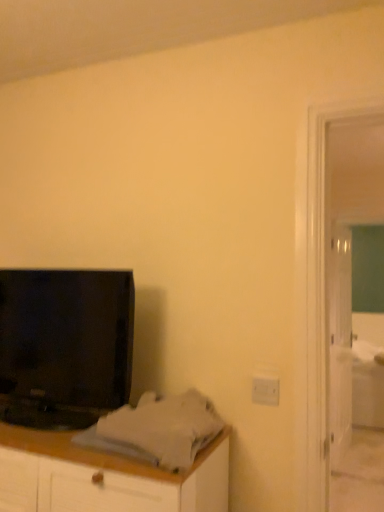
This screenshot has width=384, height=512. Describe the element at coordinates (64, 346) in the screenshot. I see `black glossy television at left` at that location.

Locate an element on the screen. The width and height of the screenshot is (384, 512). white fabric bed at right is located at coordinates (368, 372).

At what (x,y) coordinates should I click in order to perform the action: click on white glossy door at right. Please return your answer as a coordinate pair (x, y). Image resolution: width=384 pixels, height=512 pixels. Looking at the image, I should click on (340, 342).

Is point (98, 328) more distant than point (309, 280)?

Yes, it is behind point (309, 280).

Is black glossy television at left surrounding green glass screen door at right?

No.

Is the position of black glossy television at left more distant than that of green glass screen door at right?

That is False.

Is black glossy television at left turned away from white glossy door at right?

Yes, black glossy television at left is positioned with its back facing white glossy door at right.

Relative to white glossy door at right, is black glossy television at left in front or behind?

In the image, black glossy television at left appears in front of white glossy door at right.

Is black glossy television at left surrounding white glossy door at right?

No, white glossy door at right is not surrounded by black glossy television at left.

Considering the relative sizes of black glossy television at left and white glossy door at right in the image provided, is black glossy television at left shorter than white glossy door at right?

Indeed, black glossy television at left has a lesser height compared to white glossy door at right.

Does white glossy door at right have a greater width compared to black glossy television at left?

In fact, white glossy door at right might be narrower than black glossy television at left.

Who is more distant, white glossy door at right or black glossy television at left?

white glossy door at right is more distant.

From the image's perspective, is white glossy door at right located beneath black glossy television at left?

Yes.

Is white glossy door at right aimed at black glossy television at left?

No, white glossy door at right is not turned towards black glossy television at left.

How many degrees apart are the facing directions of green glass screen door at right and white glossy door at right?

83.4 degrees separate the facing orientations of green glass screen door at right and white glossy door at right.

Can you confirm if green glass screen door at right is shorter than white glossy door at right?

No.

Considering the positions of points (308, 280) and (339, 244), is point (308, 280) closer to camera compared to point (339, 244)?

Yes, it is in front of point (339, 244).

Is green glass screen door at right turned away from white glossy door at right?

Absolutely, green glass screen door at right is directed away from white glossy door at right.

Is black glossy television at left surrounded by white fabric bed at right?

No, black glossy television at left is not a part of white fabric bed at right.

Based on their positions, is white fabric bed at right located to the left or right of black glossy television at left?

white fabric bed at right is to the right of black glossy television at left.

From a real-world perspective, is white fabric bed at right over black glossy television at left?

No, from a real-world perspective, white fabric bed at right is not on top of black glossy television at left.

In the scene shown: Is white fabric bed at right beside black glossy television at left?

No.

From the image's perspective, does white fabric bed at right appear higher than white glossy door at right?

No, from the image's perspective, white fabric bed at right is not over white glossy door at right.

Considering the points (357, 354) and (334, 411), which point is in front, point (357, 354) or point (334, 411)?

Positioned in front is point (334, 411).

From a real-world perspective, is white fabric bed at right above or below white glossy door at right?

From a real-world perspective, white fabric bed at right is physically below white glossy door at right.

How many degrees apart are the facing directions of white fabric bed at right and white glossy door at right?

83.5 degrees.

Is green glass screen door at right turned away from white fabric bed at right?

Yes, green glass screen door at right is facing away from white fabric bed at right.

How distant is green glass screen door at right from white fabric bed at right?

3.11 meters.

Identify the location of screen door above the white fabric bed at right (from the image's perspective). (322, 286).

Is green glass screen door at right at the right side of white fabric bed at right?

No.

This screenshot has height=512, width=384. Identify the location of television that appears above the green glass screen door at right (from the image's perspective). (64, 346).

The image size is (384, 512). In order to click on television in front of the white glossy door at right in this screenshot , I will do `click(64, 346)`.

When comparing their distances from white fabric bed at right, does green glass screen door at right or black glossy television at left seem further?

Among the two, black glossy television at left is located further to white fabric bed at right.

Based on their spatial positions, is black glossy television at left or green glass screen door at right closer to white fabric bed at right?

green glass screen door at right is positioned closer to the anchor white fabric bed at right.

When comparing their distances from black glossy television at left, does green glass screen door at right or white fabric bed at right seem further?

The object further to black glossy television at left is white fabric bed at right.

Considering their positions, is white fabric bed at right positioned further to white glossy door at right than green glass screen door at right?

Based on the image, green glass screen door at right appears to be further to white glossy door at right.

In the scene shown: When comparing their distances from green glass screen door at right, does white fabric bed at right or white glossy door at right seem further?

white fabric bed at right.

Estimate the real-world distances between objects in this image. Which object is closer to green glass screen door at right, white glossy door at right or black glossy television at left?

black glossy television at left is closer to green glass screen door at right.

Looking at the image, which one is located closer to black glossy television at left, white glossy door at right or white fabric bed at right?

Based on the image, white glossy door at right appears to be nearer to black glossy television at left.

Looking at the image, which one is located closer to white glossy door at right, white fabric bed at right or black glossy television at left?

white fabric bed at right is closer to white glossy door at right.

Find the location of a particular element. This screenshot has width=384, height=512. door between black glossy television at left and white fabric bed at right in the front-back direction is located at coordinates (340, 342).

Find the location of `screen door between black glossy television at left and white fabric bed at right in the front-back direction`. screen door between black glossy television at left and white fabric bed at right in the front-back direction is located at coordinates (322, 286).

I want to click on door between green glass screen door at right and white fabric bed at right in the front-back direction, so click(x=340, y=342).

Where is `screen door between black glossy television at left and white glossy door at right along the z-axis`? The width and height of the screenshot is (384, 512). screen door between black glossy television at left and white glossy door at right along the z-axis is located at coordinates (322, 286).